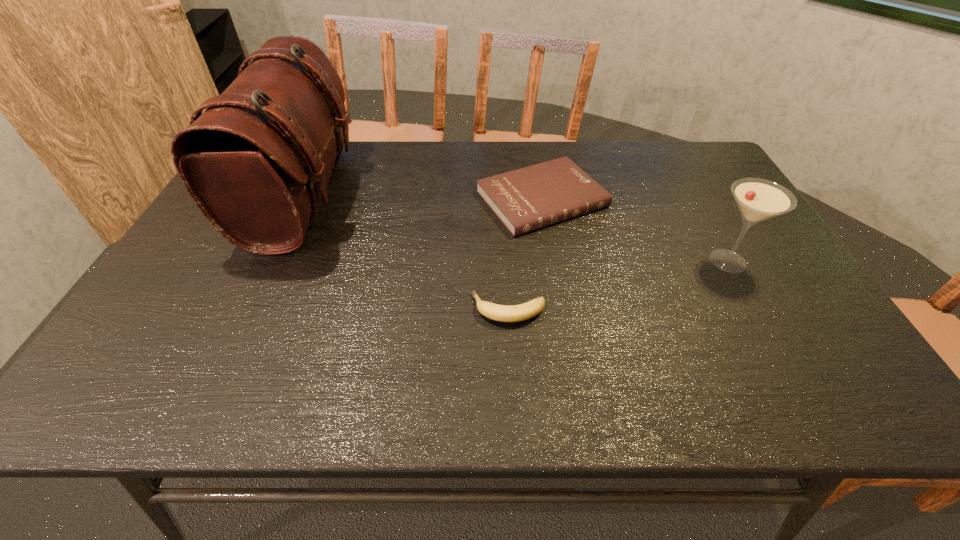
The width and height of the screenshot is (960, 540). Identify the location of object that ranks as the third closest to the hardback book. (256, 161).

This screenshot has width=960, height=540. Find the location of `free space that satisfies the following two spatial constraints: 1. on the back side of the martini; 2. on the front-facing side of the leftmost object`. free space that satisfies the following two spatial constraints: 1. on the back side of the martini; 2. on the front-facing side of the leftmost object is located at coordinates point(691,195).

You are a GUI agent. You are given a task and a screenshot of the screen. Output one action in this format:
    pyautogui.click(x=<x>, y=<y>)
    Task: Click on the free space that satisfies the following two spatial constraints: 1. on the back side of the rightmost object; 2. on the front-facing side of the satchel
    The image size is (960, 540).
    Given the screenshot: What is the action you would take?
    pyautogui.click(x=691, y=195)

The width and height of the screenshot is (960, 540). Find the location of `vacant space that satisfies the following two spatial constraints: 1. on the back side of the martini; 2. on the front-facing side of the tallest object`. vacant space that satisfies the following two spatial constraints: 1. on the back side of the martini; 2. on the front-facing side of the tallest object is located at coordinates (691, 195).

Where is `free space in the image that satisfies the following two spatial constraints: 1. on the front-facing side of the martini; 2. on the left side of the satchel`? This screenshot has width=960, height=540. free space in the image that satisfies the following two spatial constraints: 1. on the front-facing side of the martini; 2. on the left side of the satchel is located at coordinates (272, 261).

This screenshot has height=540, width=960. What are the coordinates of `vacant region that satisfies the following two spatial constraints: 1. on the front-facing side of the martini; 2. on the left side of the satchel` in the screenshot? It's located at (272, 261).

You are a GUI agent. You are given a task and a screenshot of the screen. Output one action in this format:
    pyautogui.click(x=<x>, y=<y>)
    Task: Click on the free space that satisfies the following two spatial constraints: 1. on the front-facing side of the banana; 2. on the right side of the tallest object
    
    Given the screenshot: What is the action you would take?
    pyautogui.click(x=250, y=309)

Image resolution: width=960 pixels, height=540 pixels. In order to click on vacant space that satisfies the following two spatial constraints: 1. on the front-facing side of the nearest object; 2. on the left side of the satchel in this screenshot , I will do `click(250, 309)`.

You are a GUI agent. You are given a task and a screenshot of the screen. Output one action in this format:
    pyautogui.click(x=<x>, y=<y>)
    Task: Click on the free space that satisfies the following two spatial constraints: 1. on the back side of the hardback book; 2. on the front-facing side of the leftmost object
    The image size is (960, 540).
    Given the screenshot: What is the action you would take?
    [x=541, y=195]

Identify the location of free location that satisfies the following two spatial constraints: 1. on the front-facing side of the tallest object; 2. on the left side of the banana. The height and width of the screenshot is (540, 960). click(x=250, y=309).